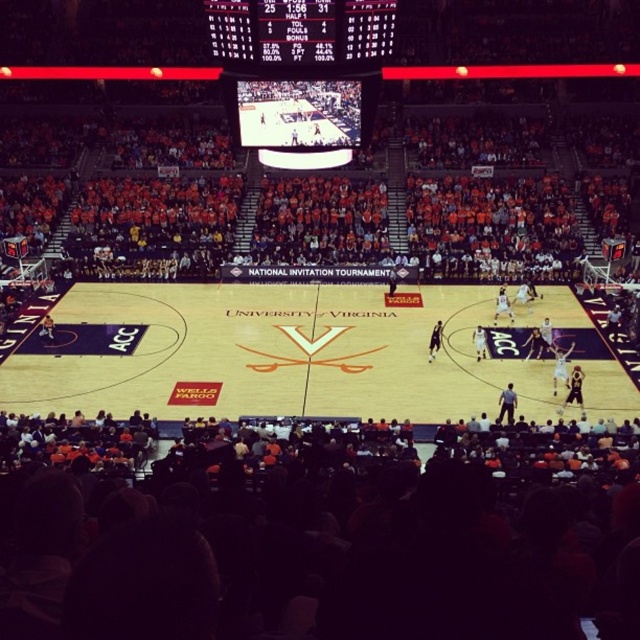
You are a photographer standing at the point where the point labeled as point (x=637, y=525) is located. You want to take a photo of the entire basketball court. Considering your position, will you be able to capture the entire court in your shot?

The point labeled as point (x=637, y=525) is 15.21 meters away from the viewer. Since this distance is sufficient to capture the entire basketball court, the photographer can take a photo of the entire court from this position.

You are a photographer trying to capture a photo of the black plastic scoreboard at upper center without any obstructions. Are the orange fabric seats at lower center blocking your view of the scoreboard?

The orange fabric seats at lower center are positioned under the black plastic scoreboard at upper center, so they are directly below it and would not block the view of the scoreboard from above.

You are a basketball player standing at the orange fabric seats at lower center. You want to throw a ball to the black glossy scoreboard at upper center. Can you reach it with a regular throw?

The distance between the orange fabric seats at lower center and the black glossy scoreboard at upper center is 35.86 feet. A regular throw by a basketball player typically has a range of about 20 to 30 feet, so it might be challenging but possible depending on the player.